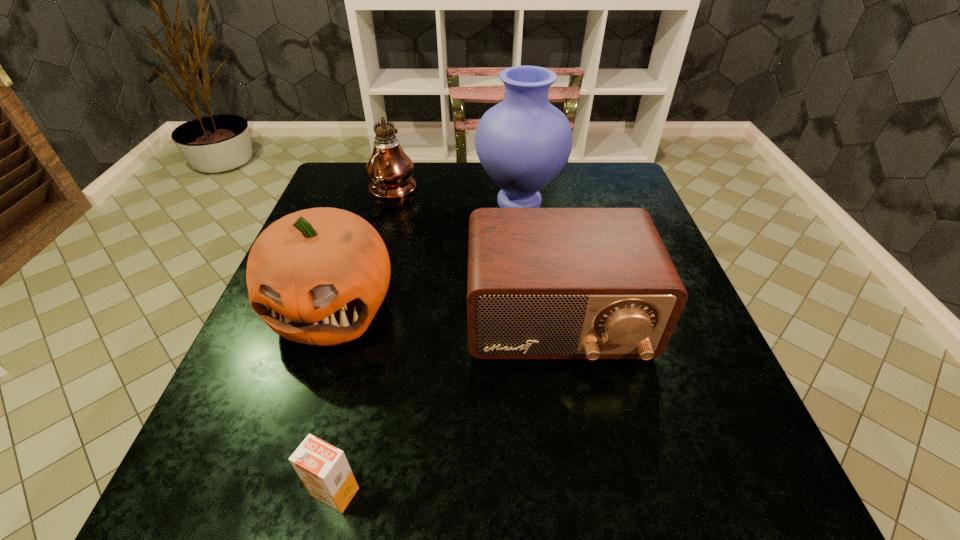
What are the coordinates of `oil lamp` in the screenshot? It's located at (390, 170).

At what (x,y) coordinates should I click in order to perform the action: click on vase. Please return your answer as a coordinate pair (x, y). Looking at the image, I should click on (523, 142).

The image size is (960, 540). Find the location of `pumpkin`. pumpkin is located at coordinates (317, 276).

The image size is (960, 540). I want to click on the second shortest object, so click(x=543, y=283).

What are the coordinates of `the shortest object` in the screenshot? It's located at click(324, 470).

Find the location of `the nearest object`. the nearest object is located at coordinates (324, 470).

Identify the location of free region located on the front of the oil lamp. click(377, 245).

The width and height of the screenshot is (960, 540). Identify the location of vacant space situated 0.070m on the back of the vase. (516, 167).

Find the location of a particular element. free space located on the face of the pumpkin is located at coordinates (292, 428).

Identify the location of free spot located 0.180m on the front panel of the radio receiver. Image resolution: width=960 pixels, height=540 pixels. point(584,475).